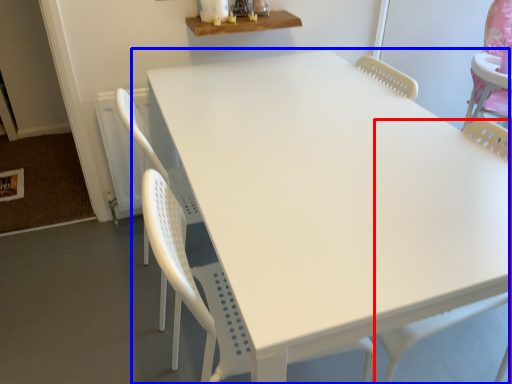
Question: Which object is closer to the camera taking this photo, swivel chair (highlighted by a red box) or table (highlighted by a blue box)?

Choices:
 (A) swivel chair
 (B) table

Answer: (A)